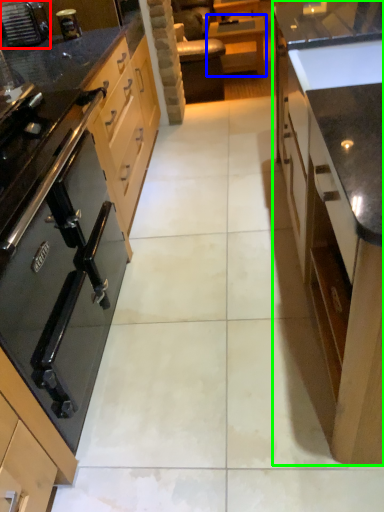
Question: Which is farther away from home appliance (highlighted by a red box)? table (highlighted by a blue box) or cabinetry (highlighted by a green box)?

Choices:
 (A) table
 (B) cabinetry

Answer: (A)